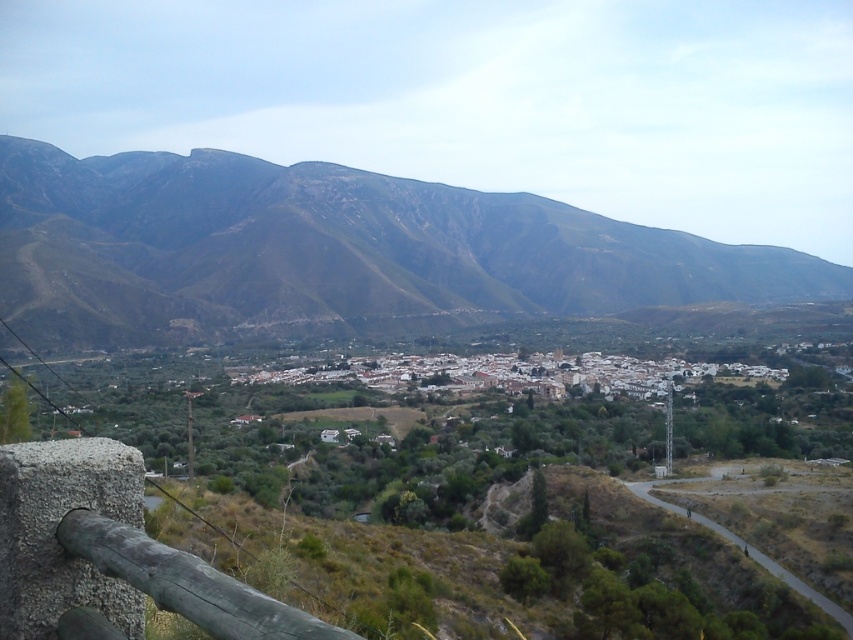
Question: Which of the following is the farthest from the observer?

Choices:
 (A) weathered wood rail at lower left
 (B) white matte town at center

Answer: (B)

Question: Which of the following is the closest to the observer?

Choices:
 (A) (405, 188)
 (B) (434, 380)

Answer: (B)

Question: In this image, where is green textured mountain at upper left located relative to white matte town at center?

Choices:
 (A) below
 (B) above

Answer: (B)

Question: From the image, what is the correct spatial relationship of green textured mountain at upper left in relation to white matte town at center?

Choices:
 (A) left
 (B) right

Answer: (A)

Question: Which object is positioned farthest from the green textured mountain at upper left?

Choices:
 (A) white matte town at center
 (B) weathered wood rail at lower left

Answer: (B)

Question: Is green textured mountain at upper left below white matte town at center?

Choices:
 (A) no
 (B) yes

Answer: (A)